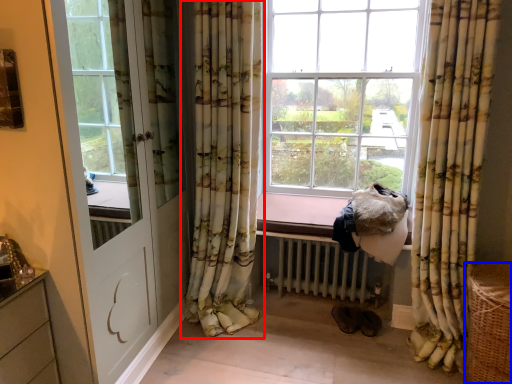
Question: Which object appears farthest to the camera in this image, curtain (highlighted by a red box) or basket (highlighted by a blue box)?

Choices:
 (A) curtain
 (B) basket

Answer: (A)